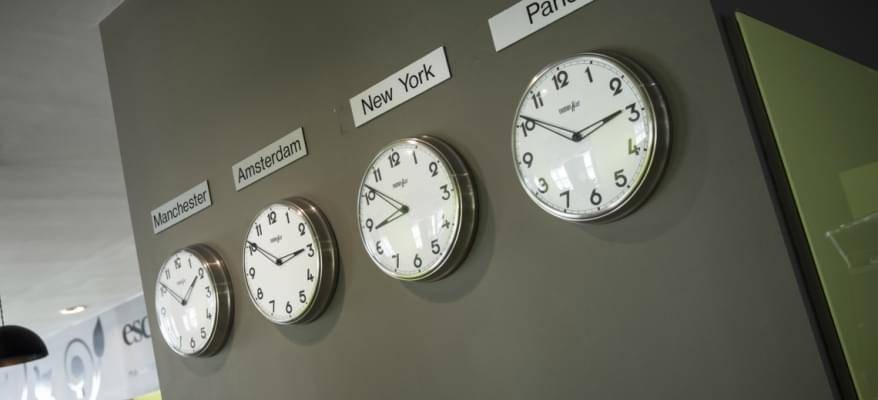
Image resolution: width=878 pixels, height=400 pixels. Identify the location of white wall. (795, 89).